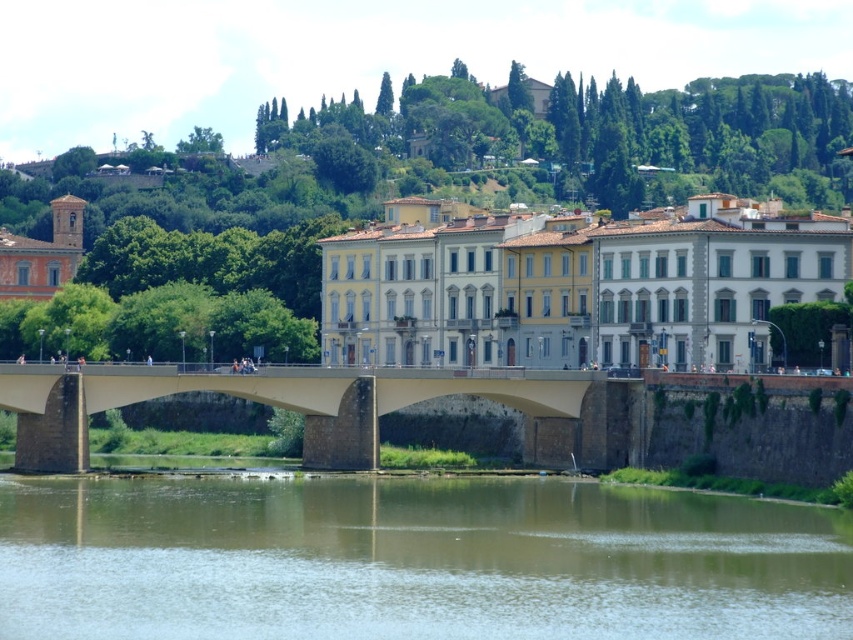
Question: Can you confirm if brown sedimentary rock at lower center is positioned above concrete bridge at center?

Choices:
 (A) yes
 (B) no

Answer: (B)

Question: Is brown sedimentary rock at lower center smaller than concrete bridge at center?

Choices:
 (A) no
 (B) yes

Answer: (B)

Question: Among these objects, which one is farthest from the camera?

Choices:
 (A) brown sedimentary rock at lower center
 (B) concrete bridge at center

Answer: (B)

Question: Which point is farther to the camera?

Choices:
 (A) brown sedimentary rock at lower center
 (B) concrete bridge at center

Answer: (B)

Question: Which object appears closest to the camera in this image?

Choices:
 (A) concrete bridge at center
 (B) brown sedimentary rock at lower center

Answer: (B)

Question: Does brown sedimentary rock at lower center have a lesser width compared to concrete bridge at center?

Choices:
 (A) yes
 (B) no

Answer: (B)